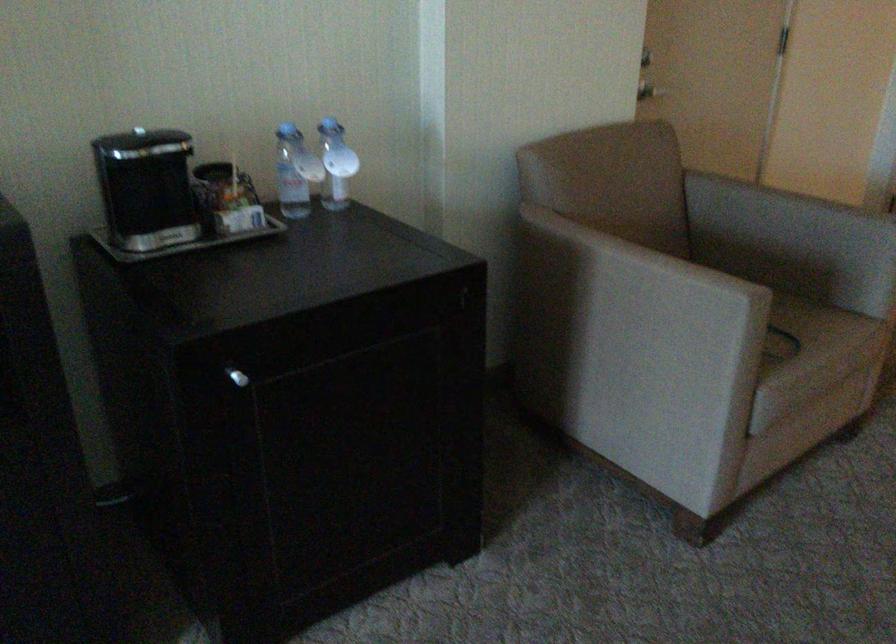
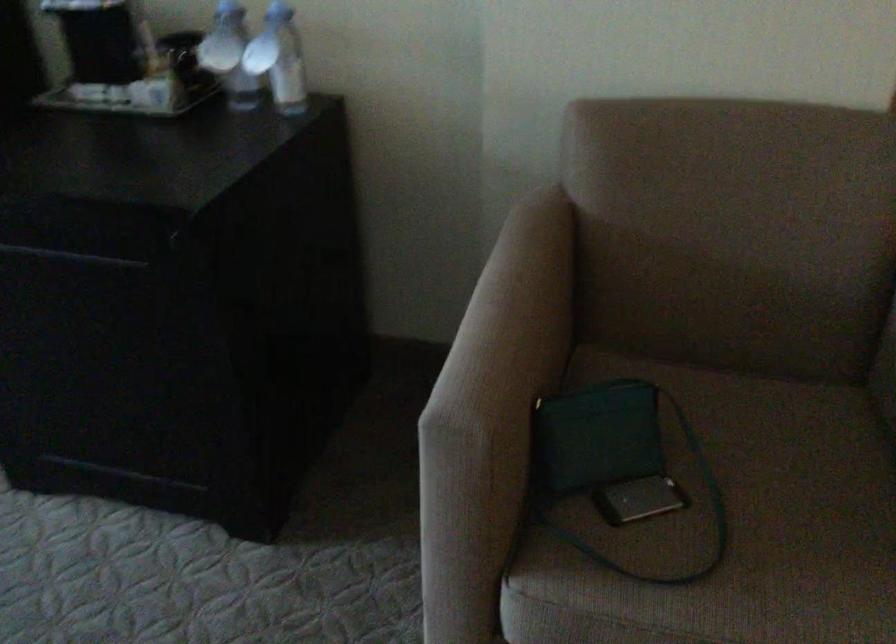
The point at (332, 164) is marked in the first image. Where is the corresponding point in the second image?

(279, 59)